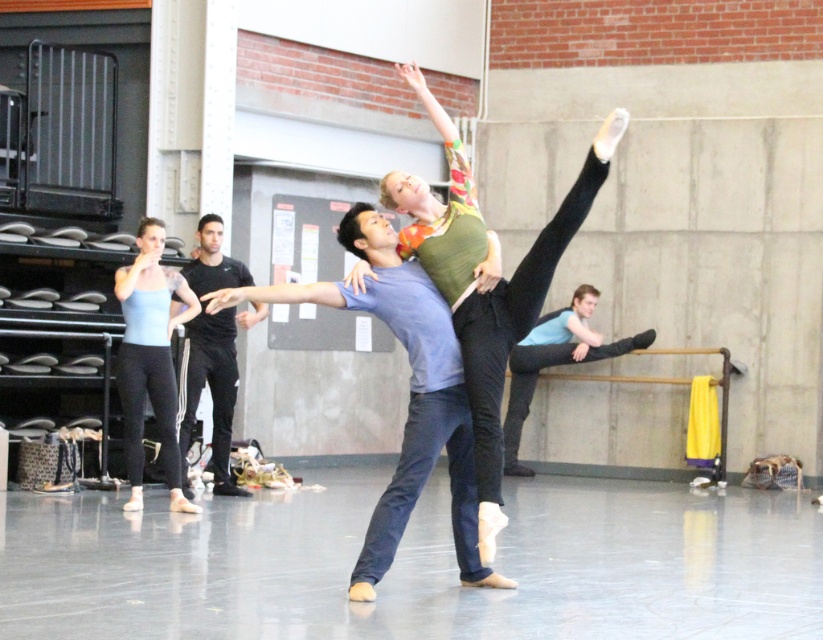
Is light blue fabric tank top at left behind black athletic wear at center?

No.

Can you confirm if light blue fabric tank top at left is wider than black athletic wear at center?

In fact, light blue fabric tank top at left might be narrower than black athletic wear at center.

This screenshot has width=823, height=640. I want to click on light blue fabric tank top at left, so click(x=150, y=358).

The image size is (823, 640). Identify the location of light blue fabric tank top at left. (150, 358).

Does point (463, 253) come in front of point (156, 333)?

That is True.

Find the location of a particular element. green jersey at center is located at coordinates (480, 284).

Is point (426, 220) positioned before point (138, 472)?

Yes, it is in front of point (138, 472).

Image resolution: width=823 pixels, height=640 pixels. What are the coordinates of `green jersey at center` in the screenshot? It's located at (480, 284).

Between matte blue shirt at center and black athletic wear at center, which one has more height?

black athletic wear at center is taller.

Which is behind, point (305, 298) or point (212, 470)?

Point (212, 470)

Is point (366, 582) positioned after point (210, 314)?

No, (366, 582) is in front of (210, 314).

Locate an element on the screen. The height and width of the screenshot is (640, 823). matte blue shirt at center is located at coordinates click(408, 394).